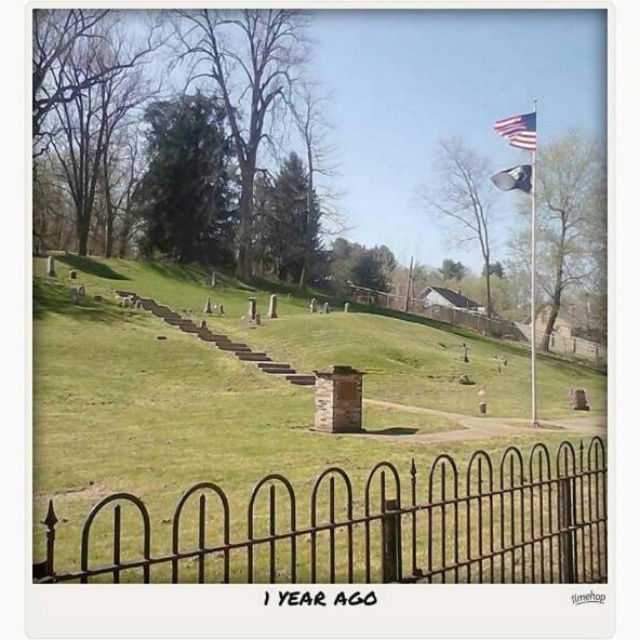
You are standing at the entrance of the cemetery and see the green grassy hillside at center and the american flag at upper right. Which object is positioned higher in the image?

The american flag at upper right is positioned higher in the image than the green grassy hillside at center.

You are standing at the cemetery entrance and see the green grassy hillside at center and the silky blue flag at upper right. Which object appears larger in the scene?

The silky blue flag at upper right appears larger than the green grassy hillside at center.